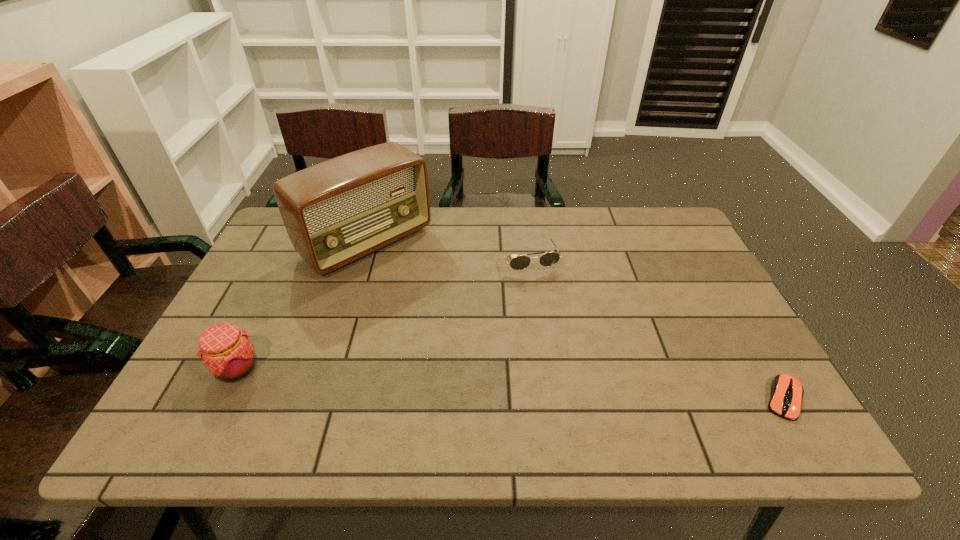
Image resolution: width=960 pixels, height=540 pixels. Find the location of `the third shortest object`. the third shortest object is located at coordinates (227, 352).

Locate an element on the screen. Image resolution: width=960 pixels, height=540 pixels. the shortest object is located at coordinates (787, 392).

The width and height of the screenshot is (960, 540). Find the location of `the rightmost object`. the rightmost object is located at coordinates (787, 392).

Identify the location of the tallest object. [x=335, y=212].

Locate an element on the screen. The image size is (960, 540). sunglasses is located at coordinates (548, 259).

At what (x,y) coordinates should I click in order to perform the action: click on the third tallest object. Please return your answer as a coordinate pair (x, y). Looking at the image, I should click on (548, 259).

What are the coordinates of `vacant space located 0.290m on the right of the jam` in the screenshot? It's located at (388, 368).

Locate an element on the screen. The image size is (960, 540). free space located 0.290m on the left of the rightmost object is located at coordinates (627, 399).

The image size is (960, 540). Find the location of `free space located 0.370m on the front-facing side of the tallest object`. free space located 0.370m on the front-facing side of the tallest object is located at coordinates (492, 351).

Identify the location of free location located on the front-facing side of the tallest object. (462, 325).